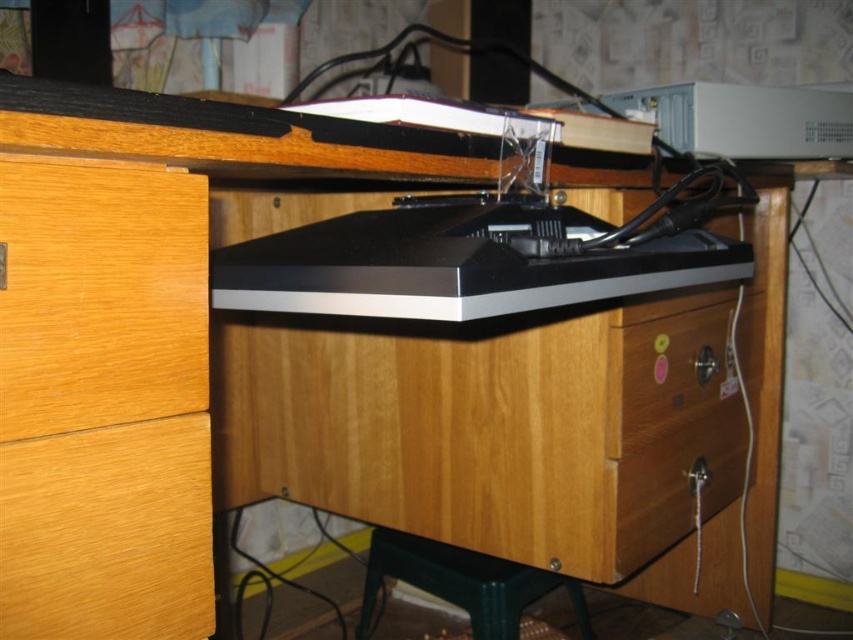
Question: Is wooden drawer at lower right thinner than green plastic stool at lower center?

Choices:
 (A) no
 (B) yes

Answer: (B)

Question: Is light wood drawer at left positioned in front of wooden drawer at lower right?

Choices:
 (A) yes
 (B) no

Answer: (A)

Question: Which is farther from the wooden drawer at lower right?

Choices:
 (A) wooden drawer at center-right
 (B) green plastic stool at lower center

Answer: (B)

Question: Which point is farther to the camera?

Choices:
 (A) (383, 566)
 (B) (677, 396)
 (C) (625, 518)
 (D) (120, 321)

Answer: (A)

Question: Which of the following is the farthest from the observer?

Choices:
 (A) (202, 429)
 (B) (483, 627)
 (C) (65, 355)

Answer: (B)

Question: Is the position of wooden drawer at center-right more distant than that of wooden drawer at lower right?

Choices:
 (A) no
 (B) yes

Answer: (A)